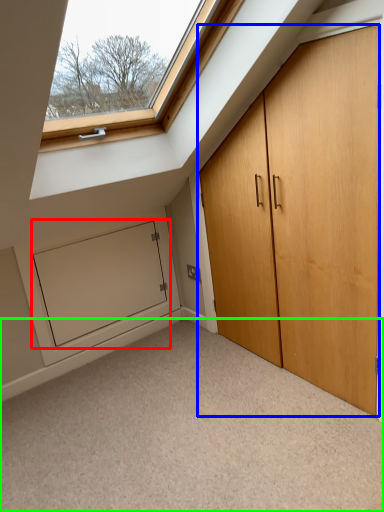
Question: Which is nearer to the screen door (highlighted by a red box)? door (highlighted by a blue box) or corridor (highlighted by a green box).

Choices:
 (A) door
 (B) corridor

Answer: (B)